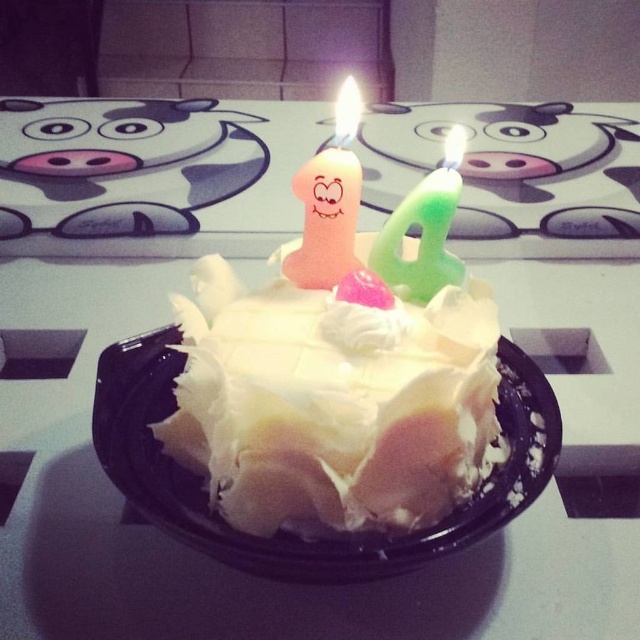
You are a guest at a birthday party and see the cake with the pink matte candle at center and the green matte candle at center. Which candle is positioned higher on the cake?

The pink matte candle at center is positioned higher than the green matte candle at center because it is placed above it on the cake.

You are planning to place a decorative ribbon around the white frosted cake at center. The ribbon you have is exactly the same width as the pink matte candle at center. Based on the scene description, will the ribbon be wide enough to cover the entire cake?

The white frosted cake at center is wider than the pink matte candle at center, so the ribbon, which matches the candle in width, will not be wide enough to cover the entire cake.

You are planning to place a birthday card on the table near the white frosted cake at center. The card is 10 cm wide. If the table is 80 cm wide and the cake is at position 0.569 on the horizontal axis, will the card fit entirely to the right of the cake without overlapping?

The white frosted cake at center is located at point 0.569 on the horizontal axis. Since the table is 80 cm wide, the remaining space to the right of the cake is 80 cm multiplied by the remaining fraction from 0.569 to 1.0. Calculating this gives 80 cm x 0.431 equals approximately 34.5 cm. The card is only 10 cm wide, so it will fit entirely to the right of the white frosted cake at center without overlapping.